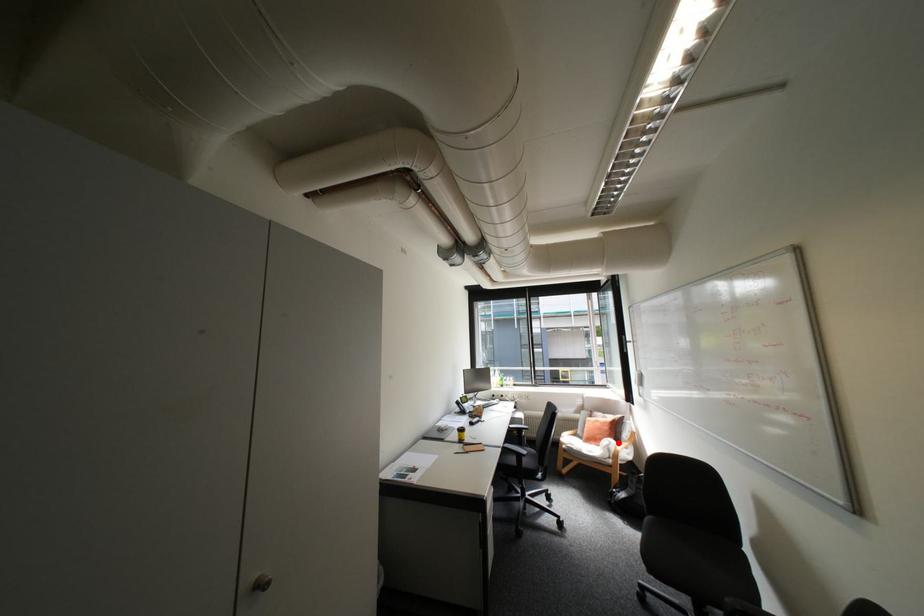
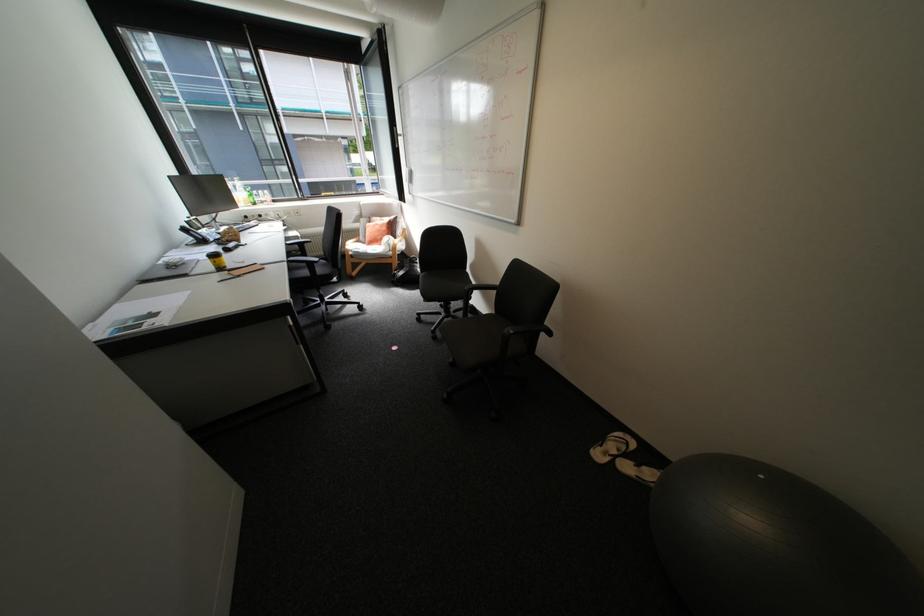
Question: I am providing you with two images of the same scene from different viewpoints. A red point is marked on the first image. Can you still see the location of the red point in image 2?

Choices:
 (A) Yes
 (B) No

Answer: (A)